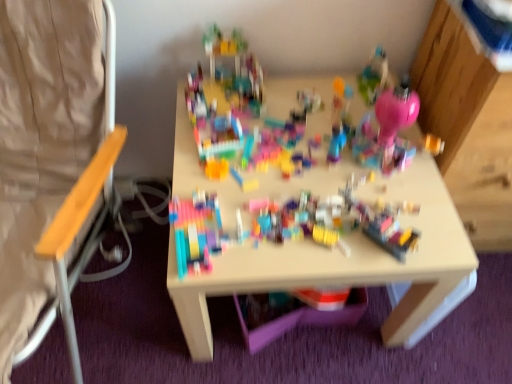
The width and height of the screenshot is (512, 384). What are the coordinates of `free point behind translucent plastic container at center, the 2th toy in the front-to-back sequence` in the screenshot? It's located at (371, 181).